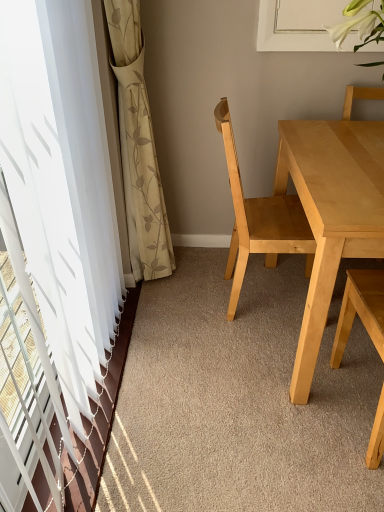
Identify the location of space that is in front of beige floral fabric curtain at left. This screenshot has width=384, height=512. (173, 334).